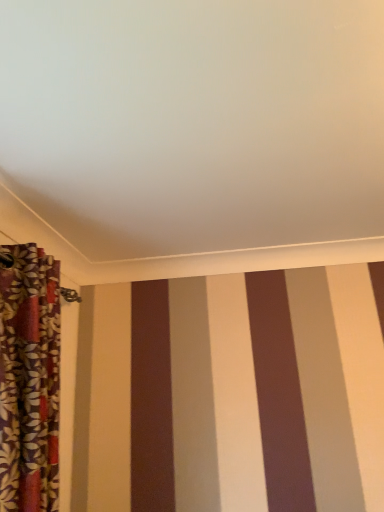
The width and height of the screenshot is (384, 512). Describe the element at coordinates (29, 380) in the screenshot. I see `floral fabric curtain at left` at that location.

Locate an element on the screen. Image resolution: width=384 pixels, height=512 pixels. floral fabric curtain at left is located at coordinates click(x=29, y=380).

Image resolution: width=384 pixels, height=512 pixels. In order to click on floral fabric curtain at left in this screenshot , I will do `click(29, 380)`.